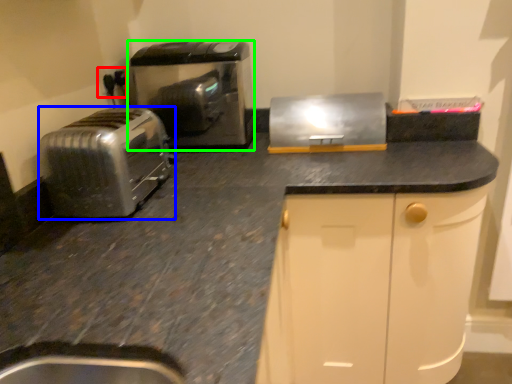
Question: Which object is positioned closest to electric outlet (highlighted by a red box)? Select from toaster (highlighted by a blue box) and home appliance (highlighted by a green box).

Choices:
 (A) toaster
 (B) home appliance

Answer: (B)